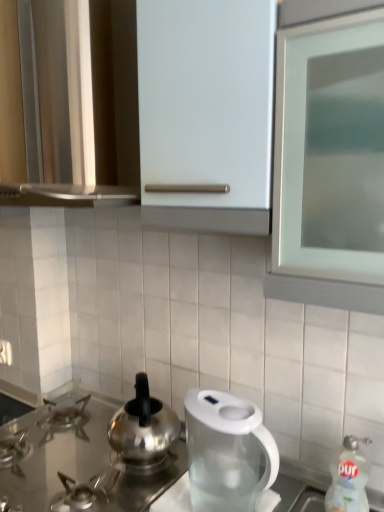
Where is `polished stainless steel kettle at center`? This screenshot has width=384, height=512. polished stainless steel kettle at center is located at coordinates (143, 425).

Where is `matte white cabinet at upper center`? This screenshot has height=512, width=384. matte white cabinet at upper center is located at coordinates (78, 100).

From the picture: From a real-world perspective, between matte white cabinet at upper center and polished stainless steel kettle at center, who is vertically lower?

In real-world perspective, polished stainless steel kettle at center is lower.

Is point (70, 181) closer or farther from the camera than point (152, 443)?

Point (70, 181) is positioned farther from the camera compared to point (152, 443).

Does matte white cabinet at upper center turn towards polished stainless steel kettle at center?

No, matte white cabinet at upper center is not facing towards polished stainless steel kettle at center.

What's the angular difference between matte white cabinet at upper center and polished stainless steel kettle at center's facing directions?

132 degrees.

Between white glossy bottle at lower right and matte white cabinet at upper center, which one appears on the left side from the viewer's perspective?

matte white cabinet at upper center is more to the left.

From the picture: Which point is more distant from viewer, (342, 452) or (113, 120)?

The point (113, 120) is farther from the camera.

Considering the sizes of objects white glossy bottle at lower right and matte white cabinet at upper center in the image provided, who is bigger, white glossy bottle at lower right or matte white cabinet at upper center?

matte white cabinet at upper center is bigger.

Between white glossy bottle at lower right and matte white cabinet at upper center, which one has more height?

Standing taller between the two is matte white cabinet at upper center.

Who is bigger, transparent plastic kettle at center or polished stainless steel kettle at center?

transparent plastic kettle at center is bigger.

Is transparent plastic kettle at center in front of polished stainless steel kettle at center?

That is True.

Is transparent plastic kettle at center located outside polished stainless steel kettle at center?

Indeed, transparent plastic kettle at center is completely outside polished stainless steel kettle at center.

From the image's perspective, which one is positioned lower, transparent plastic kettle at center or polished stainless steel kettle at center?

From the image's view, transparent plastic kettle at center is below.

From a real-world perspective, is polished stainless steel kettle at center on white glossy bottle at lower right?

Yes, from a real-world perspective, polished stainless steel kettle at center is above white glossy bottle at lower right.

Which object is positioned more to the right, polished stainless steel kettle at center or white glossy bottle at lower right?

Positioned to the right is white glossy bottle at lower right.

In terms of size, does polished stainless steel kettle at center appear bigger or smaller than white glossy bottle at lower right?

In the image, polished stainless steel kettle at center appears to be larger than white glossy bottle at lower right.

Considering the relative sizes of matte white cabinet at upper center and satin silver gas stove at lower left in the image provided, is matte white cabinet at upper center taller than satin silver gas stove at lower left?

Yes, matte white cabinet at upper center is taller than satin silver gas stove at lower left.

Between matte white cabinet at upper center and satin silver gas stove at lower left, which one has larger size?

matte white cabinet at upper center is bigger.

Does matte white cabinet at upper center contain satin silver gas stove at lower left?

No, matte white cabinet at upper center does not contain satin silver gas stove at lower left.

Is matte white cabinet at upper center looking in the opposite direction of satin silver gas stove at lower left?

matte white cabinet at upper center is not turned away from satin silver gas stove at lower left.

Is satin silver gas stove at lower left facing towards polished stainless steel kettle at center?

No, satin silver gas stove at lower left is not facing towards polished stainless steel kettle at center.

Considering the relative sizes of satin silver gas stove at lower left and polished stainless steel kettle at center in the image provided, is satin silver gas stove at lower left wider than polished stainless steel kettle at center?

Correct, the width of satin silver gas stove at lower left exceeds that of polished stainless steel kettle at center.

From a real-world perspective, is satin silver gas stove at lower left over polished stainless steel kettle at center?

No.

Is satin silver gas stove at lower left inside or outside of polished stainless steel kettle at center?

satin silver gas stove at lower left cannot be found inside polished stainless steel kettle at center.

Considering their positions, is polished stainless steel kettle at center located in front of or behind transparent plastic kettle at center?

polished stainless steel kettle at center is behind transparent plastic kettle at center.

Would you say transparent plastic kettle at center is part of polished stainless steel kettle at center's contents?

No, polished stainless steel kettle at center does not contain transparent plastic kettle at center.

Between polished stainless steel kettle at center and transparent plastic kettle at center, which one has less height?

polished stainless steel kettle at center.

From a real-world perspective, who is located higher, polished stainless steel kettle at center or transparent plastic kettle at center?

In real-world perspective, transparent plastic kettle at center is above.

Where is `kitchen appliance below the matte white cabinet at upper center (from the image's perspective)`? The width and height of the screenshot is (384, 512). kitchen appliance below the matte white cabinet at upper center (from the image's perspective) is located at coordinates (143, 425).

You are a GUI agent. You are given a task and a screenshot of the screen. Output one action in this format:
    pyautogui.click(x=<x>, y=<y>)
    Task: Click on the cabinetry in front of the white glossy bottle at lower right
    The image size is (384, 512).
    Given the screenshot: What is the action you would take?
    pyautogui.click(x=78, y=100)

Which object lies nearer to the anchor point polished stainless steel kettle at center, matte white cabinet at upper center or satin silver gas stove at lower left?

Among the two, satin silver gas stove at lower left is located nearer to polished stainless steel kettle at center.

From the image, which object appears to be nearer to satin silver gas stove at lower left, transparent plastic kettle at center or white glossy bottle at lower right?

transparent plastic kettle at center is closer to satin silver gas stove at lower left.

Based on their spatial positions, is matte white cabinet at upper center or satin silver gas stove at lower left closer to white glossy bottle at lower right?

Among the two, satin silver gas stove at lower left is located nearer to white glossy bottle at lower right.

Based on their spatial positions, is white glossy bottle at lower right or satin silver gas stove at lower left closer to matte white cabinet at upper center?

The object closer to matte white cabinet at upper center is satin silver gas stove at lower left.

Which object lies further to the anchor point transparent plastic kettle at center, white glossy bottle at lower right or matte white cabinet at upper center?

matte white cabinet at upper center lies further to transparent plastic kettle at center than the other object.

Considering their positions, is white glossy bottle at lower right positioned closer to transparent plastic kettle at center than polished stainless steel kettle at center?

polished stainless steel kettle at center lies closer to transparent plastic kettle at center than the other object.

From the image, which object appears to be nearer to transparent plastic kettle at center, polished stainless steel kettle at center or white glossy bottle at lower right?

polished stainless steel kettle at center.

Based on their spatial positions, is transparent plastic kettle at center or matte white cabinet at upper center closer to white glossy bottle at lower right?

Among the two, transparent plastic kettle at center is located nearer to white glossy bottle at lower right.

I want to click on tea set between polished stainless steel kettle at center and white glossy bottle at lower right from left to right, so click(x=228, y=439).

I want to click on kitchen appliance situated between satin silver gas stove at lower left and transparent plastic kettle at center from left to right, so click(143, 425).

The image size is (384, 512). Identify the location of tea set between matte white cabinet at upper center and white glossy bottle at lower right in the vertical direction. [228, 439].

This screenshot has width=384, height=512. Find the location of `kitchen appliance situated between satin silver gas stove at lower left and white glossy bottle at lower right from left to right`. kitchen appliance situated between satin silver gas stove at lower left and white glossy bottle at lower right from left to right is located at coordinates (143, 425).